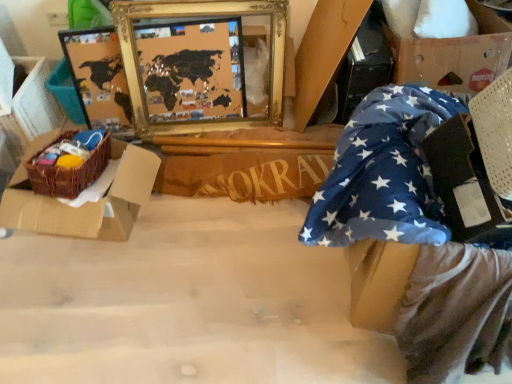
Question: From the image's perspective, is wooden sign at center located above or below blue fabric at right, placed as the second cardboard box when sorted from right to left?

Choices:
 (A) above
 (B) below

Answer: (B)

Question: Do you think wooden sign at center is within blue fabric at right, placed as the second cardboard box when sorted from right to left, or outside of it?

Choices:
 (A) outside
 (B) inside

Answer: (A)

Question: Estimate the real-world distances between objects in this image. Which object is closer to the brown woven basket at left?

Choices:
 (A) blue star-patterned fabric at lower right
 (B) brown woven basket at left
 (C) blue fabric at right, placed as the second cardboard box when sorted from right to left
 (D) cardboard box at upper right, which ranks as the second cardboard box in left-to-right order
 (E) gold-framed map at upper center

Answer: (B)

Question: Based on their relative distances, which object is nearer to the brown woven basket at left?

Choices:
 (A) brown woven basket at left
 (B) cardboard box at upper right, placed as the 1th cardboard box when sorted from right to left
 (C) gold-framed map at upper center
 (D) blue fabric at right, placed as the second cardboard box when sorted from right to left
 (E) wooden sign at center

Answer: (A)